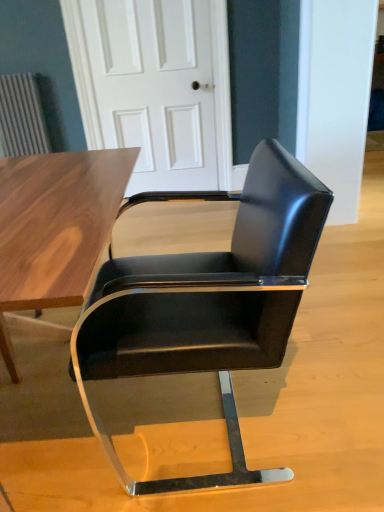
Measure the distance between black leather chair at center and camera.

The depth of black leather chair at center is 80.89 centimeters.

What do you see at coordinates (207, 302) in the screenshot? I see `black leather chair at center` at bounding box center [207, 302].

Find the location of a particular element. Image resolution: width=384 pixels, height=512 pixels. black leather chair at center is located at coordinates pyautogui.click(x=207, y=302).

Describe the element at coordinates (156, 87) in the screenshot. I see `white glossy door at center` at that location.

You are a GUI agent. You are given a task and a screenshot of the screen. Output one action in this format:
    pyautogui.click(x=<x>, y=<y>)
    Task: Click on the white glossy door at center
    This screenshot has width=384, height=512.
    Given the screenshot: What is the action you would take?
    pyautogui.click(x=156, y=87)

This screenshot has height=512, width=384. What are the coordinates of `black leather chair at center` in the screenshot? It's located at (207, 302).

Which is more to the right, white glossy door at center or black leather chair at center?

From the viewer's perspective, black leather chair at center appears more on the right side.

In the image, is white glossy door at center positioned in front of or behind black leather chair at center?

Clearly, white glossy door at center is behind black leather chair at center.

Is point (221, 39) positioned before point (226, 484)?

No, (221, 39) is behind (226, 484).

From the image's perspective, is white glossy door at center above or below black leather chair at center?

From the image's perspective, white glossy door at center appears above black leather chair at center.

From a real-world perspective, is white glossy door at center above or below black leather chair at center?

In terms of real-world spatial position, white glossy door at center is above black leather chair at center.

In terms of width, does white glossy door at center look wider or thinner when compared to black leather chair at center?

Clearly, white glossy door at center has less width compared to black leather chair at center.

Does white glossy door at center have a greater height compared to black leather chair at center?

Yes.

Does white glossy door at center have a smaller size compared to black leather chair at center?

Indeed, white glossy door at center has a smaller size compared to black leather chair at center.

Could black leather chair at center be considered to be inside white glossy door at center?

No, black leather chair at center is not inside white glossy door at center.

Does white glossy door at center touch black leather chair at center?

white glossy door at center and black leather chair at center are clearly separated.

Looking at this image, could you tell me if white glossy door at center is turned towards black leather chair at center?

Yes, white glossy door at center is facing black leather chair at center.

Image resolution: width=384 pixels, height=512 pixels. I want to click on door above the black leather chair at center (from the image's perspective), so click(x=156, y=87).

Is black leather chair at center to the right of white glossy door at center from the viewer's perspective?

Indeed, black leather chair at center is positioned on the right side of white glossy door at center.

Is black leather chair at center positioned in front of white glossy door at center?

Yes, the depth of black leather chair at center is less than that of white glossy door at center.

Considering the positions of point (86, 365) and point (162, 22), is point (86, 365) closer or farther from the camera than point (162, 22)?

Clearly, point (86, 365) is closer to the camera than point (162, 22).

From the image's perspective, would you say black leather chair at center is shown under white glossy door at center?

Indeed, from the image's perspective, black leather chair at center is shown beneath white glossy door at center.

From a real-world perspective, is black leather chair at center physically below white glossy door at center?

Yes.

Which of these two, black leather chair at center or white glossy door at center, is thinner?

Thinner between the two is white glossy door at center.

Considering the sizes of black leather chair at center and white glossy door at center in the image, is black leather chair at center taller or shorter than white glossy door at center?

black leather chair at center is shorter than white glossy door at center.

Between black leather chair at center and white glossy door at center, which one has smaller size?

white glossy door at center is smaller.

Choose the correct answer: Is black leather chair at center inside white glossy door at center or outside it?

black leather chair at center is not inside white glossy door at center, it's outside.

Is there a large distance between black leather chair at center and white glossy door at center?

Yes, black leather chair at center and white glossy door at center are located far from each other.

In the scene shown: Is black leather chair at center aimed at white glossy door at center?

No, black leather chair at center is not oriented towards white glossy door at center.

How different are the orientations of black leather chair at center and white glossy door at center in degrees?

The facing directions of black leather chair at center and white glossy door at center are 88.5 degrees apart.

The image size is (384, 512). I want to click on door on the left of black leather chair at center, so click(x=156, y=87).

Image resolution: width=384 pixels, height=512 pixels. Find the location of `door behind the black leather chair at center`. door behind the black leather chair at center is located at coordinates pos(156,87).

You are a GUI agent. You are given a task and a screenshot of the screen. Output one action in this format:
    pyautogui.click(x=<x>, y=<y>)
    Task: Click on the chair to the right of white glossy door at center
    The width and height of the screenshot is (384, 512).
    Given the screenshot: What is the action you would take?
    pyautogui.click(x=207, y=302)